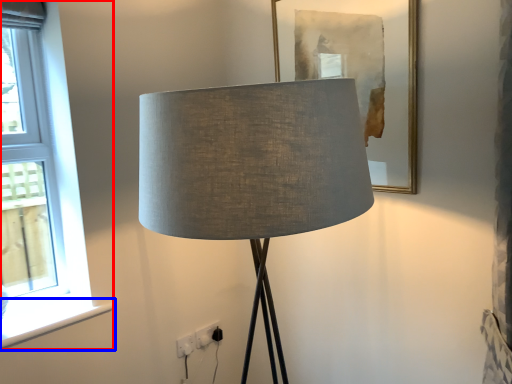
Question: Among these objects, which one is nearest to the camera, window (highlighted by a red box) or window sill (highlighted by a blue box)?

Choices:
 (A) window
 (B) window sill

Answer: (A)